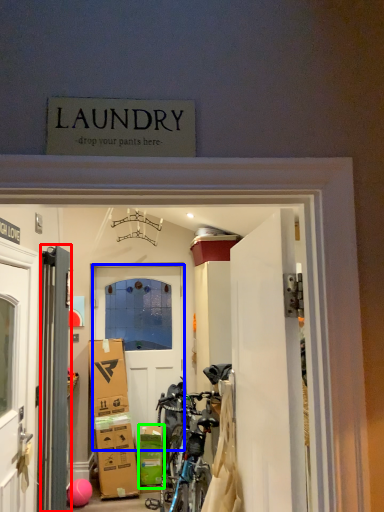
Question: Estimate the real-world distances between objects in this image. Which object is closer to door (highlighted by a red box), door (highlighted by a blue box) or cardboard box (highlighted by a green box)?

Choices:
 (A) door
 (B) cardboard box

Answer: (B)